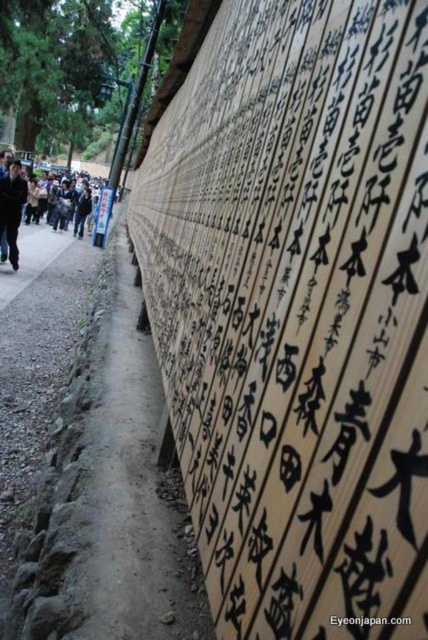
You are standing on the wooden wall with Japanese calligraphy and see the point at coordinates (x=130, y=490). What is the location of this point relative to the dirt path at center?

The point at coordinates (x=130, y=490) is located on the dirt path at center.

You are a visitor at the shrine and want to take a photo of the dirt path at center and the dark blue jacket at left. Which object takes up more space in the photo?

The dark blue jacket at left occupies more space in the photo than the dirt path at center because the dirt path at center occupies less space than dark blue jacket at left.